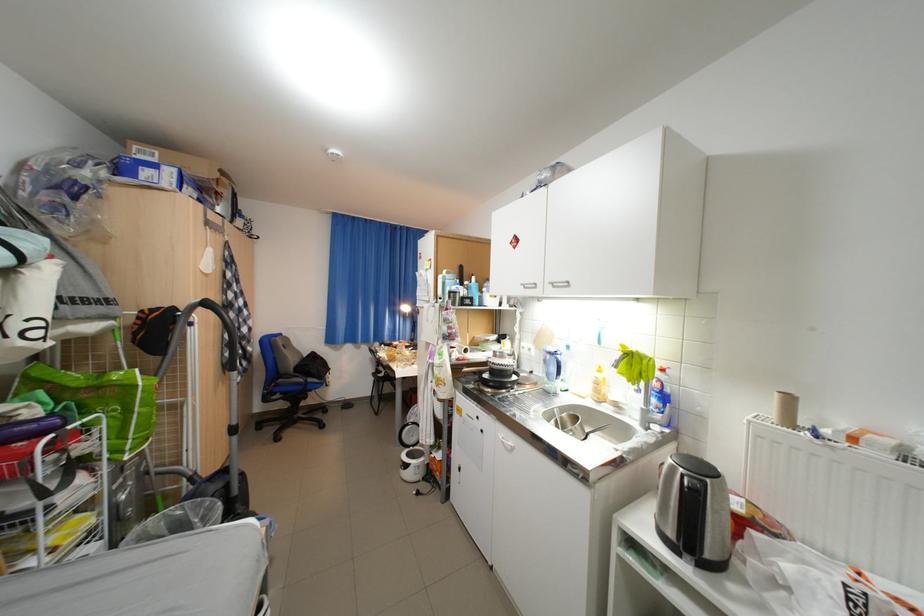
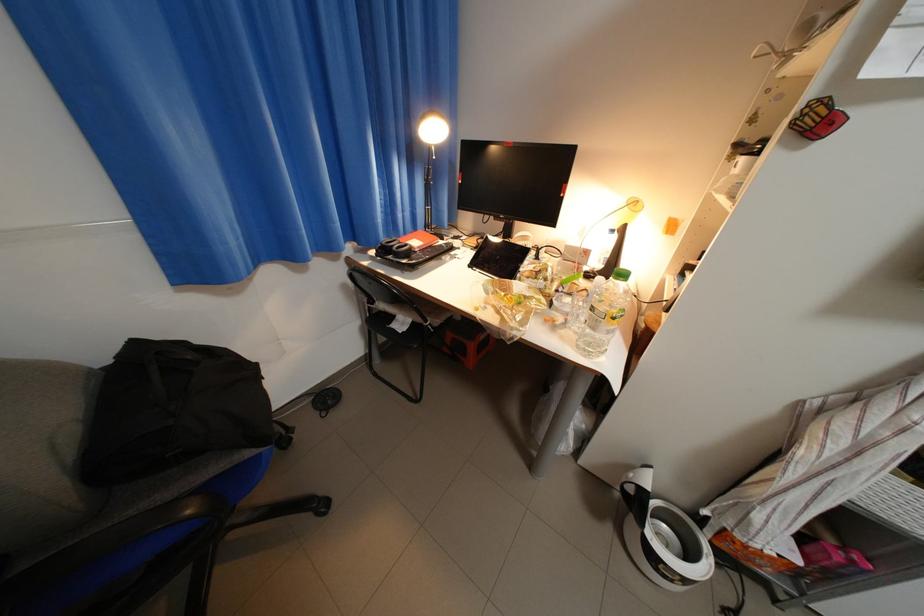
In the second image, find the point that corresponds to (383,359) in the first image.

(355, 286)